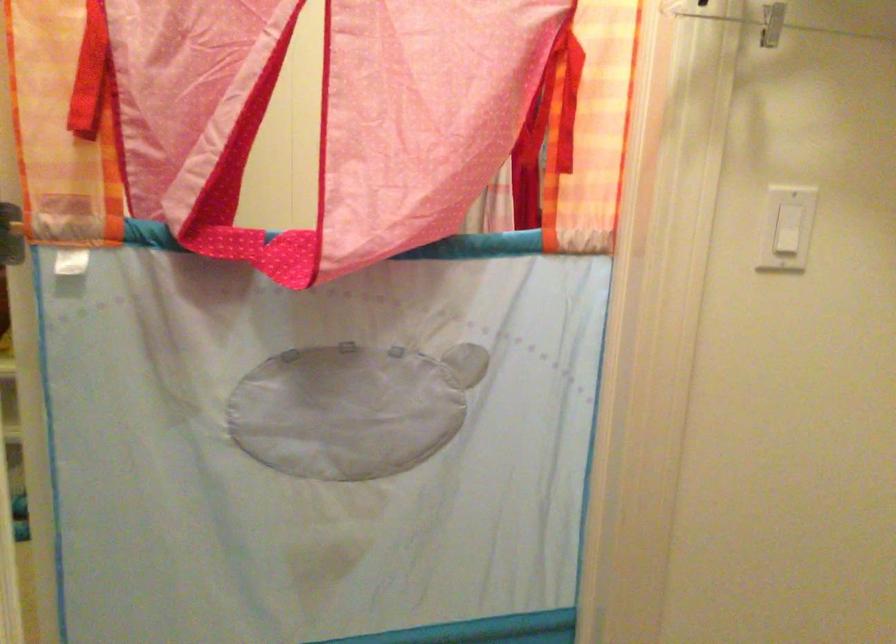
The width and height of the screenshot is (896, 644). Describe the element at coordinates (90, 73) in the screenshot. I see `a red fabric tie` at that location.